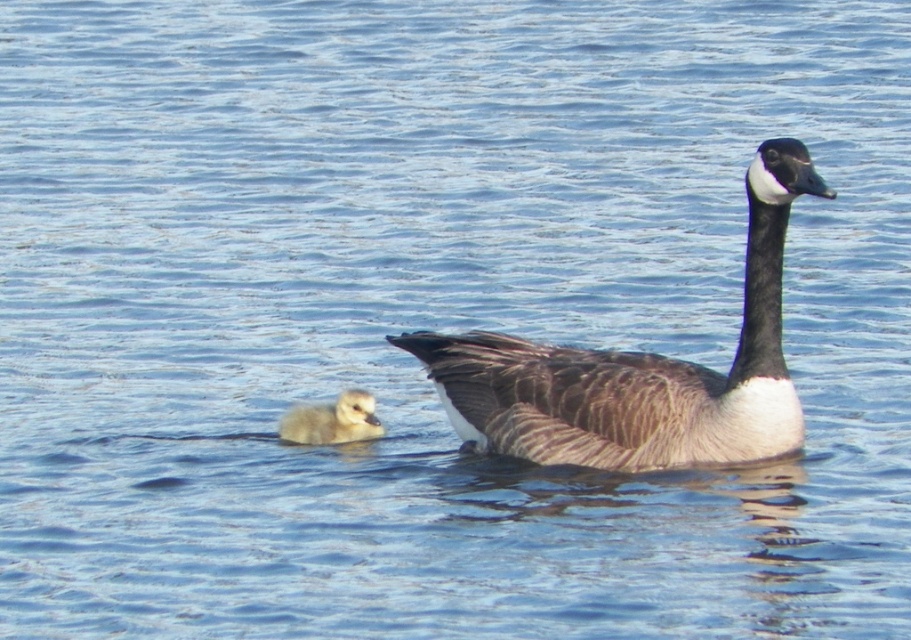
You are a wildlife photographer aiming to capture a photo of the brown textured goose at center and the light brown downy gosling at lower left. If you want to ensure both are in focus, which one should you focus on first?

The brown textured goose at center is larger in size than the light brown downy gosling at lower left, so you should focus on the brown textured goose at center first since larger objects often require more precise focus to capture details effectively.

You are a wildlife photographer aiming to capture a photo of the brown textured goose at center and the light brown downy gosling at lower left. Your camera has a 100mm lens that can focus on objects within a 15 inch range. Can you take a photo of both subjects simultaneously without moving the camera?

The distance between the brown textured goose at center and the light brown downy gosling at lower left is 19.66 inches. Since the camera lens can only focus within a 15 inch range, it cannot capture both subjects simultaneously without moving the camera.

You are a wildlife photographer aiming to capture the brown textured goose at center in your shot. Based on its position, which part of the image should you focus on to ensure it is centered in your viewfinder?

The brown textured goose at center is located at point coordinates approximately 0.578 along the horizontal axis and 0.703 along the vertical axis. To center it in your viewfinder, aim the camera so that the crosshairs align with these coordinates.